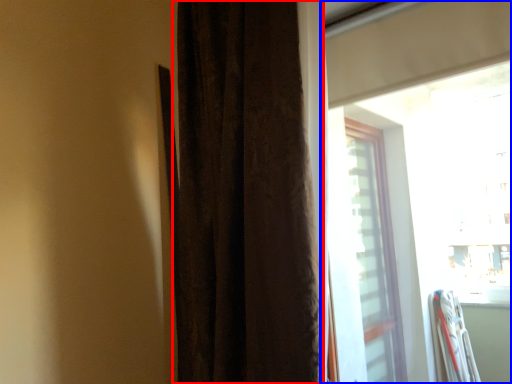
Question: Which point is further to the camera, curtain (highlighted by a red box) or window (highlighted by a blue box)?

Choices:
 (A) curtain
 (B) window

Answer: (A)